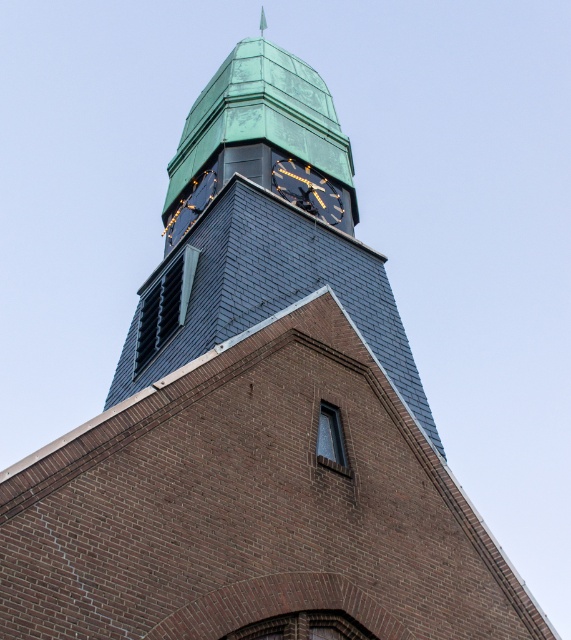
You are an architect examining the brick building with a clock tower. You notice the green copper clock tower at upper center and the black metal clock at upper center. Which object is taller?

The green copper clock tower at upper center is much taller than the black metal clock at upper center.

You are standing in front of a brick building with a clock tower. You see the black metal clock at upper center. Can you tell me the exact coordinates of the clock?

The black metal clock at upper center is located at coordinates (307, 189).